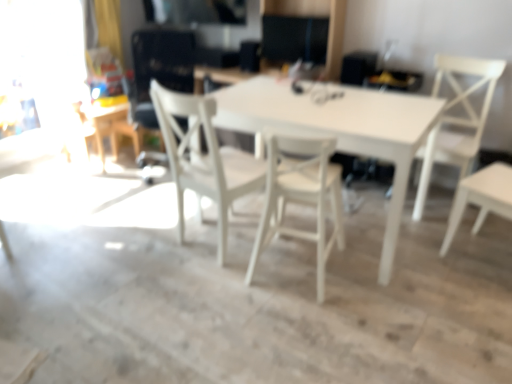
Find the location of a particular element. empty space that is to the right of white wood chair at center, positioned as the second chair in right-to-left order is located at coordinates (390, 276).